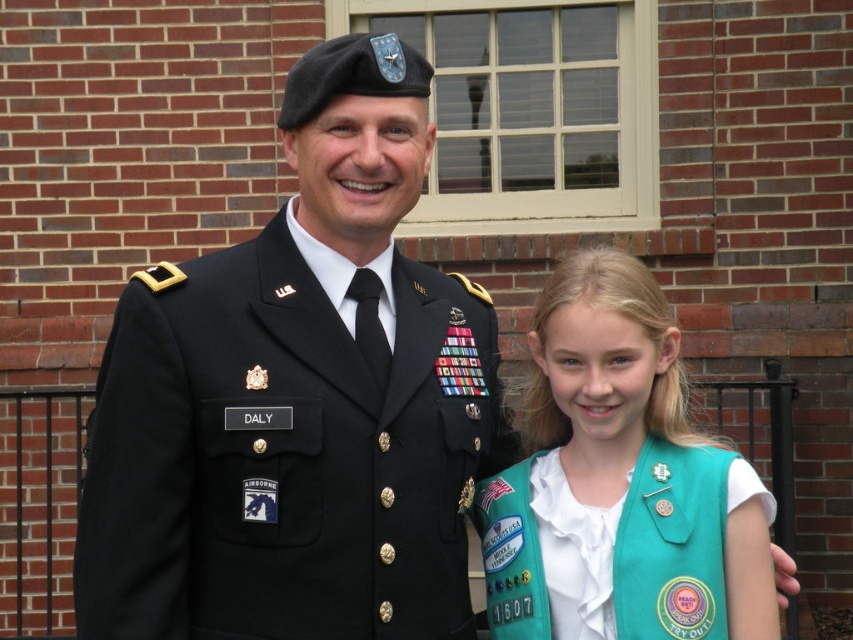
Question: Is black matte uniform at center closer to the viewer compared to teal fabric vest at right?

Choices:
 (A) yes
 (B) no

Answer: (A)

Question: Is black matte uniform at center smaller than teal fabric vest at right?

Choices:
 (A) yes
 (B) no

Answer: (B)

Question: Is black matte uniform at center below teal fabric vest at right?

Choices:
 (A) no
 (B) yes

Answer: (A)

Question: Which point is farther to the camera?

Choices:
 (A) (283, 147)
 (B) (560, 368)

Answer: (A)

Question: Among these objects, which one is farthest from the camera?

Choices:
 (A) teal fabric vest at right
 (B) black matte uniform at center

Answer: (A)

Question: Which object appears closest to the camera in this image?

Choices:
 (A) black matte uniform at center
 (B) teal fabric vest at right

Answer: (A)